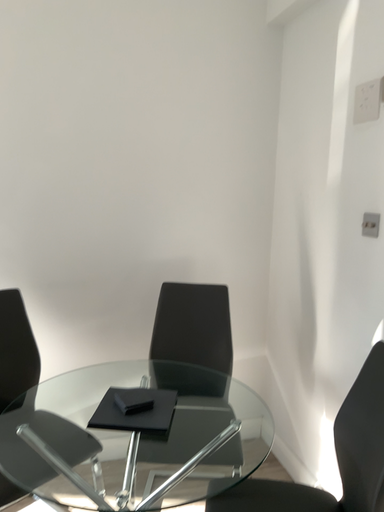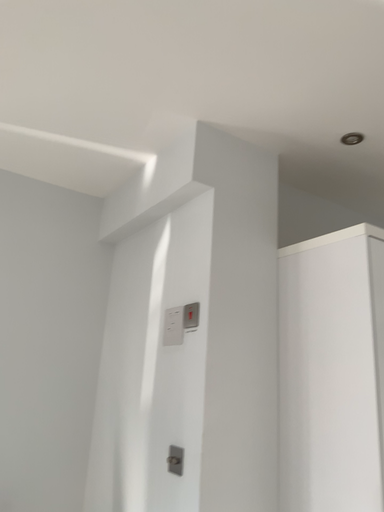
Question: Which way did the camera rotate in the video?

Choices:
 (A) rotated downward
 (B) rotated upward

Answer: (B)